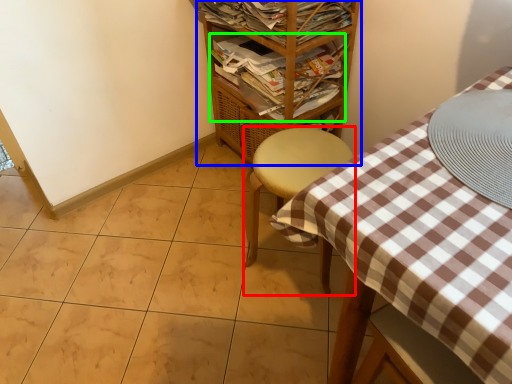
Question: Which object is the farthest from furniture (highlighted by a red box)? Choose among these: shelf (highlighted by a blue box) or magazine (highlighted by a green box).

Choices:
 (A) shelf
 (B) magazine

Answer: (A)